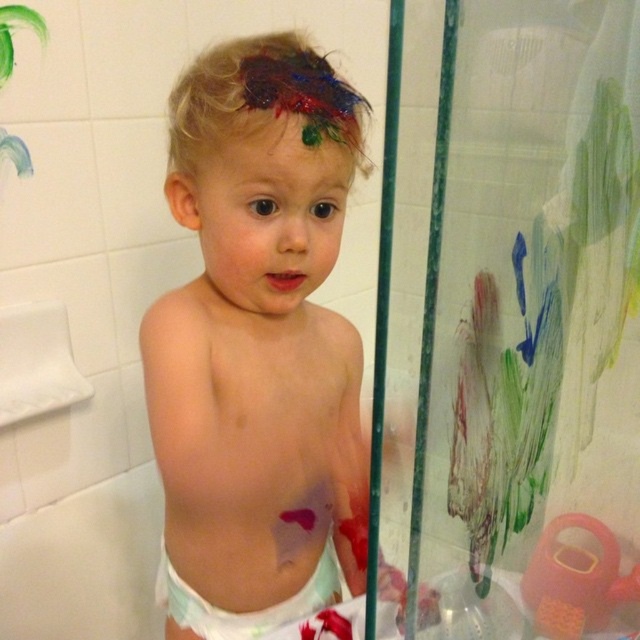
You are a parent trying to clean up after your child in the bathroom. You see the dirty diaper at center and the multicolored paint at center. Which item takes up more horizontal space?

The dirty diaper at center has a larger width than the multicolored paint at center, so the dirty diaper at center takes up more horizontal space.

You are a parent looking at the bathroom scene. You see the dirty diaper at center and the multicolored paint at center. Which object is closer to you?

The dirty diaper at center is closer to you because the multicolored paint at center is behind it.

You are a parent looking for the dirty diaper at center in the bathroom. The transparent plastic screen door at upper right is blocking your view. Can you see the diaper through the door?

The transparent plastic screen door at upper right is in front of the dirty diaper at center, so yes, you can see the diaper through the door since it is transparent.